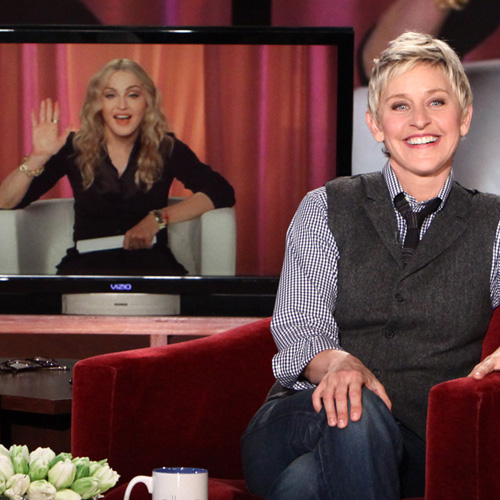
Find the location of a particular element. This screenshot has width=500, height=500. tv is located at coordinates (206, 32).